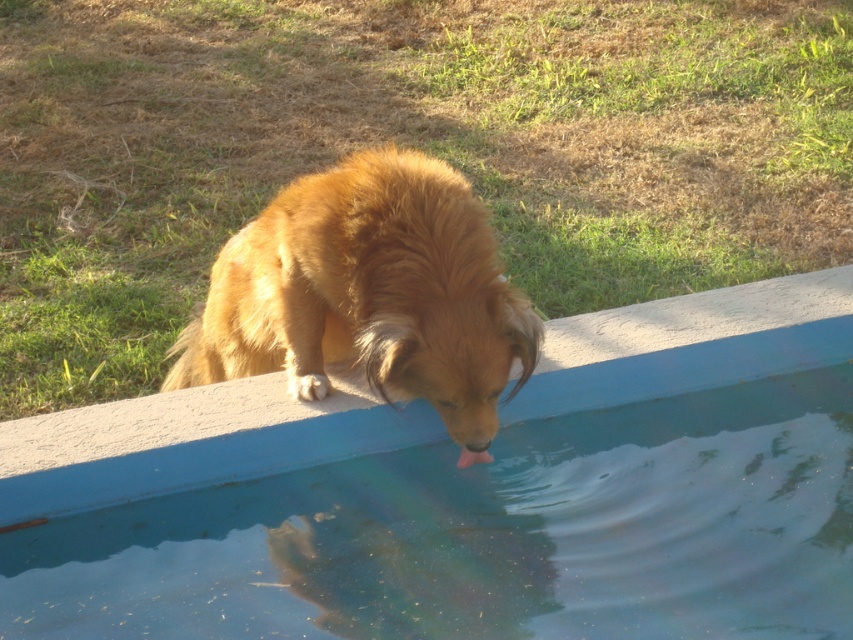
You are standing near the pool and want to take a photo of the golden fur dog at lower center and the blue concrete swimming pool at lower center. Which object should you focus on first to ensure both are in clear view?

You should focus on the blue concrete swimming pool at lower center first because it is closer to the viewer than the golden fur dog at lower center, so adjusting focus from near to far will help both be in clear view.

You are a photographer trying to capture the golden fur dog at lower center drinking from the blue concrete swimming pool at lower center. Since you want to focus on the dog, should you adjust your camera to focus on the object that is closer to you?

The blue concrete swimming pool at lower center is below golden fur dog at lower center, meaning the dog is closer to you. Therefore, you should focus on the golden fur dog at lower center to ensure it is in sharp focus.